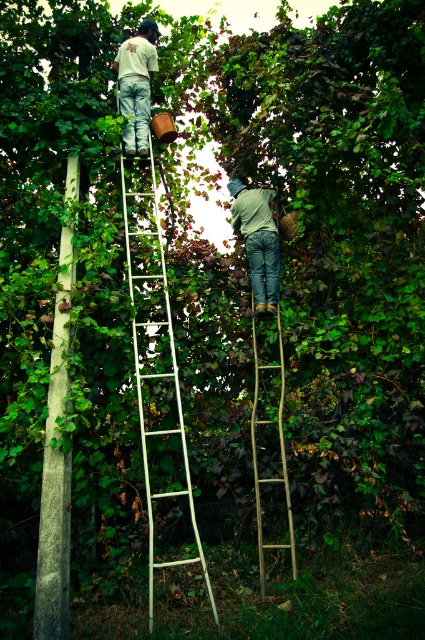
Question: Which of the following is the closest to the observer?

Choices:
 (A) gray concrete pole at left
 (B) white metal ladder at center
 (C) white cotton shirt at upper center
 (D) green denim jeans at center

Answer: (A)

Question: Where is gray concrete pole at left located in relation to bamboo ladder at center in the image?

Choices:
 (A) below
 (B) above

Answer: (B)

Question: Which object is farther from the camera taking this photo?

Choices:
 (A) white cotton shirt at upper center
 (B) bamboo ladder at center
 (C) gray concrete pole at left
 (D) green denim jeans at center

Answer: (A)

Question: Which object appears closest to the camera in this image?

Choices:
 (A) white cotton shirt at upper center
 (B) bamboo ladder at center
 (C) green denim jeans at center
 (D) white metal ladder at center

Answer: (D)

Question: Is white metal ladder at center positioned behind green denim jeans at center?

Choices:
 (A) yes
 (B) no

Answer: (B)

Question: From the image, what is the correct spatial relationship of white metal ladder at center in relation to gray concrete pole at left?

Choices:
 (A) above
 (B) below

Answer: (A)